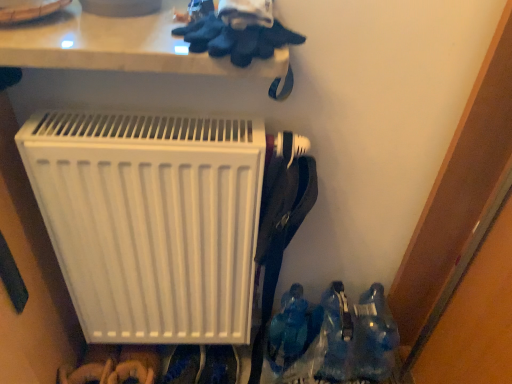
Question: Is translucent plastic bottles at lower right inside or outside of white plastic radiator at center?

Choices:
 (A) inside
 (B) outside

Answer: (B)

Question: Is translucent plastic bottles at lower right wider or thinner than white plastic radiator at center?

Choices:
 (A) thin
 (B) wide

Answer: (B)

Question: Considering the positions of translucent plastic bottles at lower right and white plastic radiator at center in the image, is translucent plastic bottles at lower right taller or shorter than white plastic radiator at center?

Choices:
 (A) tall
 (B) short

Answer: (B)

Question: From the image's perspective, is white plastic radiator at center above or below translucent plastic bottles at lower right?

Choices:
 (A) above
 (B) below

Answer: (A)

Question: Does point (140, 145) appear closer or farther from the camera than point (378, 317)?

Choices:
 (A) closer
 (B) farther

Answer: (A)

Question: Considering the positions of white plastic radiator at center and translucent plastic bottles at lower right in the image, is white plastic radiator at center wider or thinner than translucent plastic bottles at lower right?

Choices:
 (A) wide
 (B) thin

Answer: (B)

Question: From a real-world perspective, is white plastic radiator at center above or below translucent plastic bottles at lower right?

Choices:
 (A) below
 (B) above

Answer: (B)